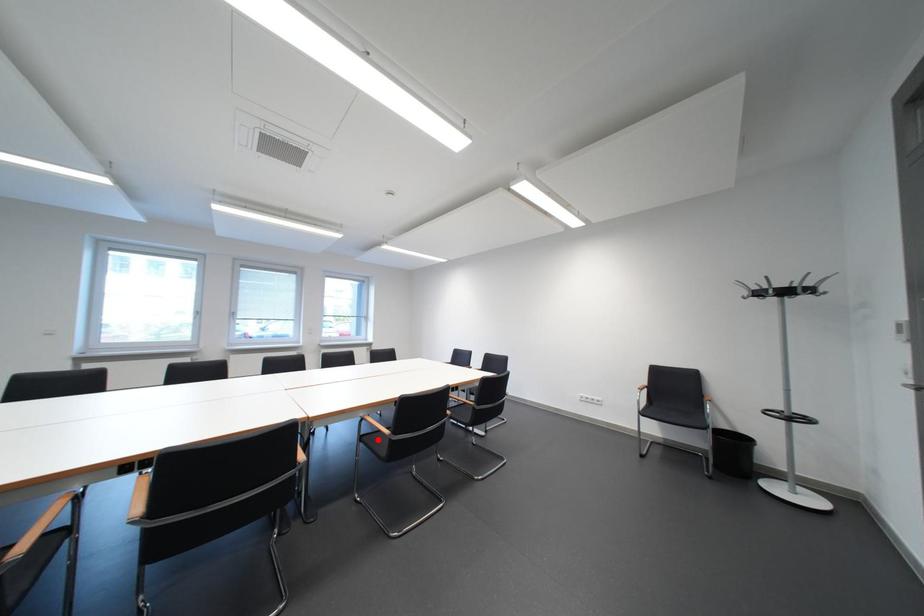
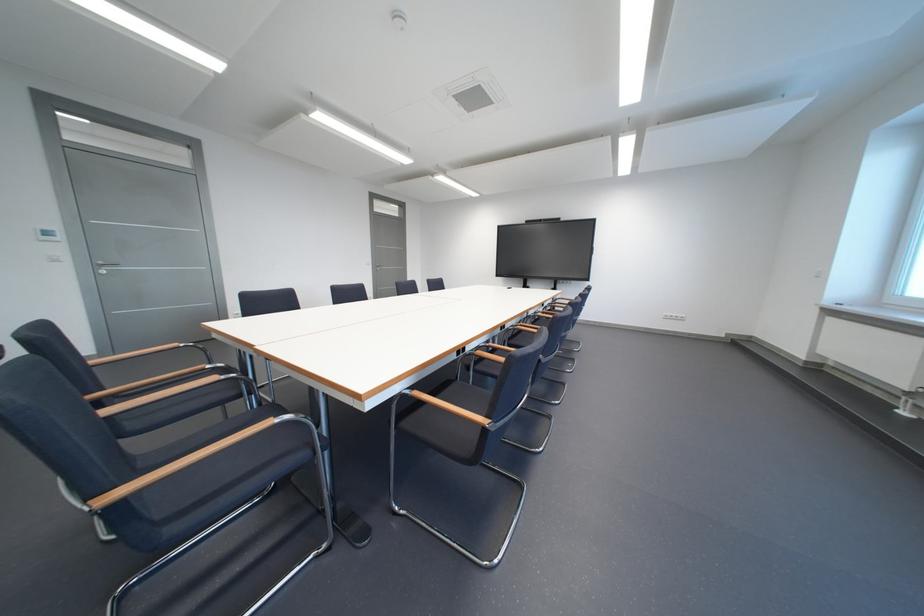
Question: I am providing you with two images of the same scene from different viewpoints. A red point is marked on the first image. Is the red point's position out of view in image 2?

Choices:
 (A) Yes
 (B) No

Answer: (A)